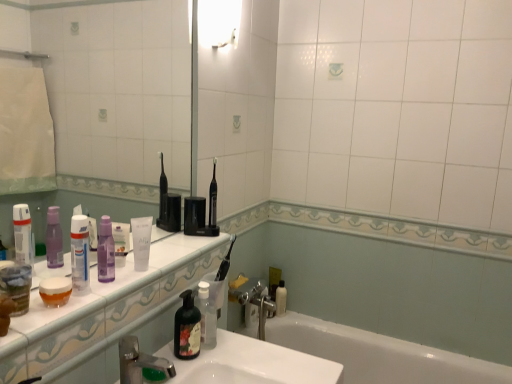
At what (x,y) coordinates should I click in order to perform the action: click on free point behind transparent plastic bottle at left, which is the first toiletry from front to back. Please return your answer as a coordinate pair (x, y). The width and height of the screenshot is (512, 384). Looking at the image, I should click on (130, 274).